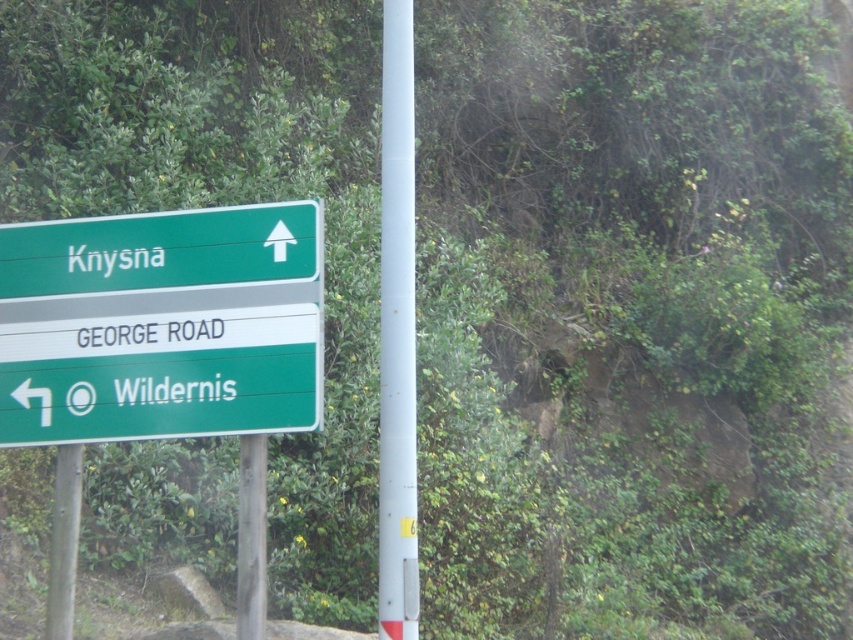
You are standing at the roadside and see the green plastic sign at left and the metallic pole at lower left. Which object is nearer to you?

The green plastic sign at left is closer to the viewer than the metallic pole at lower left, so the green plastic sign at left is nearer to you.

You are a delivery driver who needs to deliver a package to Knysna. You see the green plastic sign at upper center and the metallic pole at lower left. According to the sign, which direction should you turn to reach Knysna?

The green plastic sign at upper center indicates that Knysna is in the upward direction, so you should continue straight ahead to reach Knysna.

You are standing at the roadside and see the directional signboard mounted on the metallic pole at center and another metallic pole at lower left. Which pole is closer to you?

The metallic pole at center is closer to you because it is in front of the metallic pole at lower left.